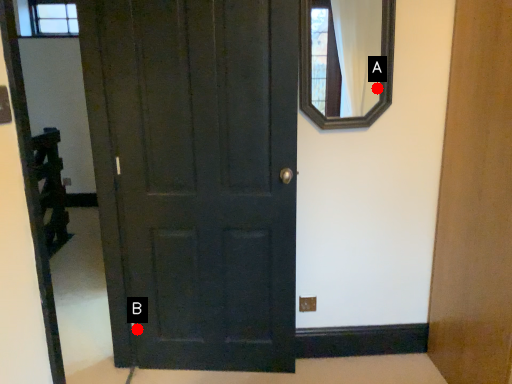
Question: Two points are circled on the image, labeled by A and B beside each circle. Which point is closer to the camera?

Choices:
 (A) A is closer
 (B) B is closer

Answer: (A)